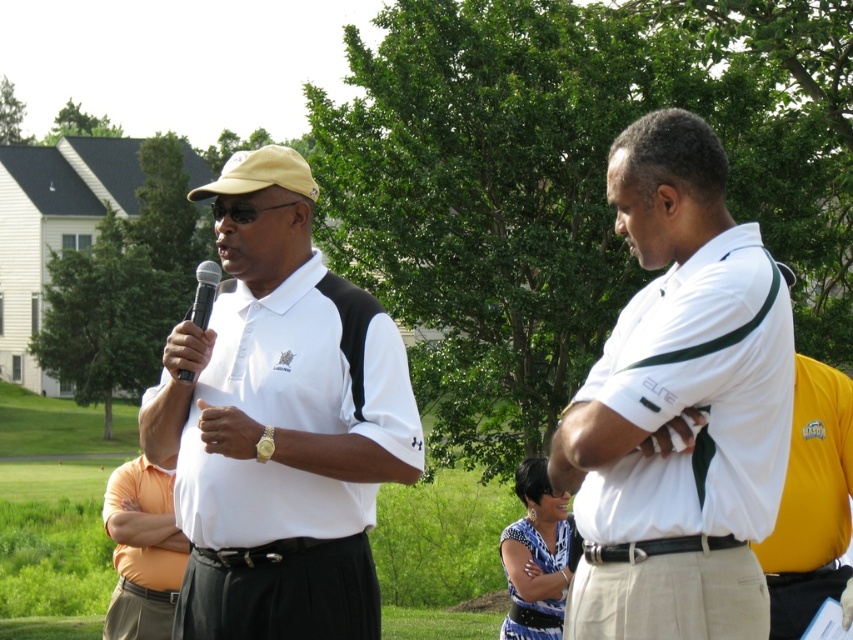
From the picture: Is matte white polo shirt at center above white smooth shirt at center?

Yes.

Where is `matte white polo shirt at center`? The height and width of the screenshot is (640, 853). matte white polo shirt at center is located at coordinates (280, 422).

Can you confirm if matte white polo shirt at center is taller than orange cotton shirt at center?

Incorrect, matte white polo shirt at center's height is not larger of orange cotton shirt at center's.

Image resolution: width=853 pixels, height=640 pixels. What do you see at coordinates (280, 422) in the screenshot?
I see `matte white polo shirt at center` at bounding box center [280, 422].

Where is `matte white polo shirt at center`? matte white polo shirt at center is located at coordinates (x=280, y=422).

Can you confirm if white smooth shirt at center is positioned above orange cotton shirt at center?

Indeed, white smooth shirt at center is positioned over orange cotton shirt at center.

Can you confirm if white smooth shirt at center is positioned to the right of orange cotton shirt at center?

Correct, you'll find white smooth shirt at center to the right of orange cotton shirt at center.

Describe the element at coordinates (679, 404) in the screenshot. I see `white smooth shirt at center` at that location.

This screenshot has height=640, width=853. Find the location of `white smooth shirt at center`. white smooth shirt at center is located at coordinates (679, 404).